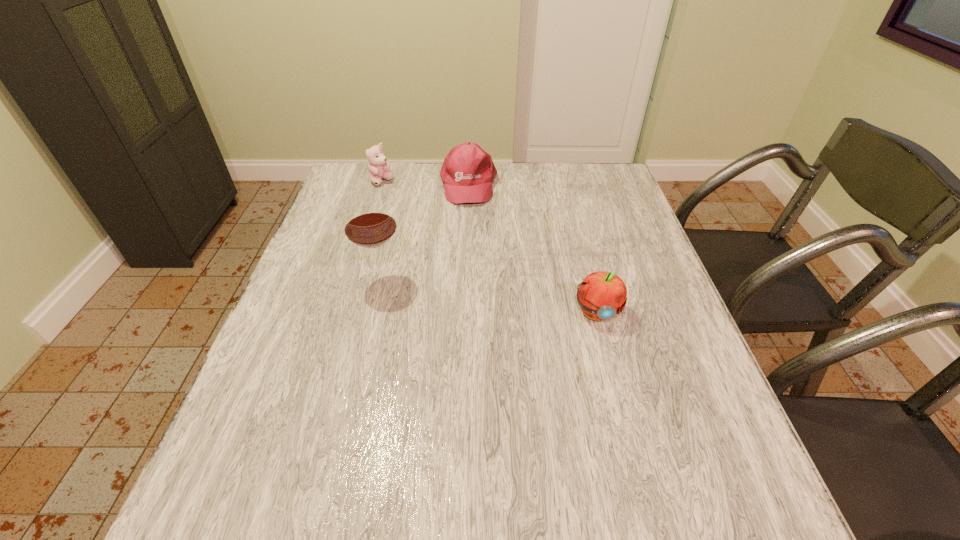
Image resolution: width=960 pixels, height=540 pixels. What are the coordinates of `blank area located 0.100m at the face of the teddy bear` in the screenshot? It's located at (399, 201).

Where is `vacant space situated at the face of the teddy bear`? vacant space situated at the face of the teddy bear is located at coordinates coord(420,225).

Locate an element on the screen. This screenshot has height=540, width=960. baseball cap present at the far edge is located at coordinates (467, 173).

Locate an element on the screen. This screenshot has height=540, width=960. teddy bear that is at the far edge is located at coordinates (378, 166).

This screenshot has width=960, height=540. Find the location of `wineglass located at the left edge`. wineglass located at the left edge is located at coordinates (369, 223).

This screenshot has height=540, width=960. I want to click on teddy bear present at the left edge, so click(378, 166).

The image size is (960, 540). Identify the location of object that is at the right edge. coord(602,295).

This screenshot has width=960, height=540. I want to click on object that is at the far left corner, so click(x=378, y=166).

This screenshot has height=540, width=960. In the image, there is a desktop. What are the coordinates of `blank space at the far edge` in the screenshot? It's located at (523, 184).

The height and width of the screenshot is (540, 960). Identify the location of free point at the near edge. (546, 456).